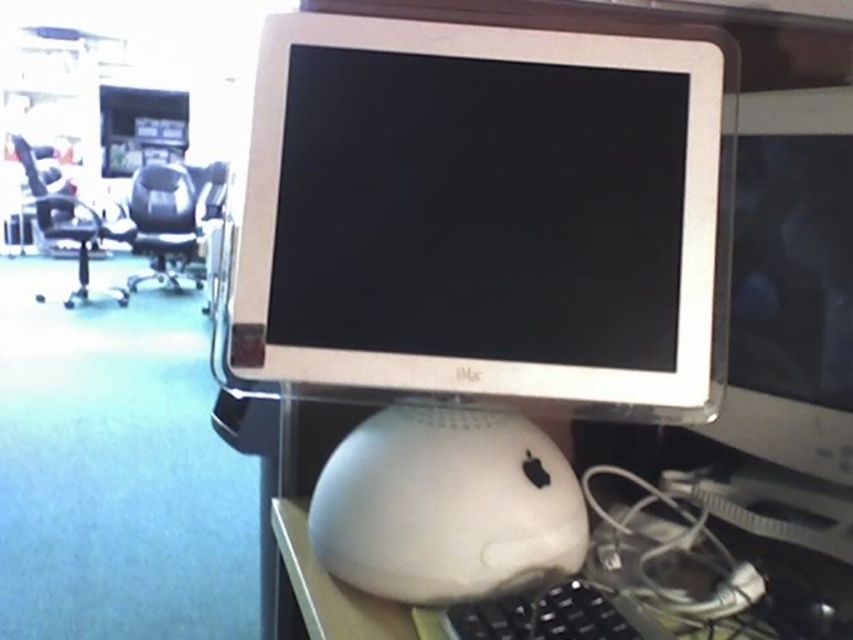
Question: Is white plastic table at lower center further to the viewer compared to black plastic swivel chair at left?

Choices:
 (A) no
 (B) yes

Answer: (A)

Question: Which point is farther from the camera taking this photo?

Choices:
 (A) (36, 202)
 (B) (325, 547)

Answer: (A)

Question: Is white matte mouse at center below white plastic table at lower center?

Choices:
 (A) no
 (B) yes

Answer: (A)

Question: Which object is closer to the camera taking this photo?

Choices:
 (A) black plastic swivel chair at left
 (B) white plastic monitor at center
 (C) white plastic table at lower center
 (D) black plastic keyboard at lower center

Answer: (D)

Question: Is black plastic keyboard at lower center further to the viewer compared to black leather swivel chair at center?

Choices:
 (A) yes
 (B) no

Answer: (B)

Question: Among these objects, which one is farthest from the camera?

Choices:
 (A) black plastic keyboard at lower center
 (B) black leather swivel chair at center
 (C) white matte mouse at center

Answer: (B)